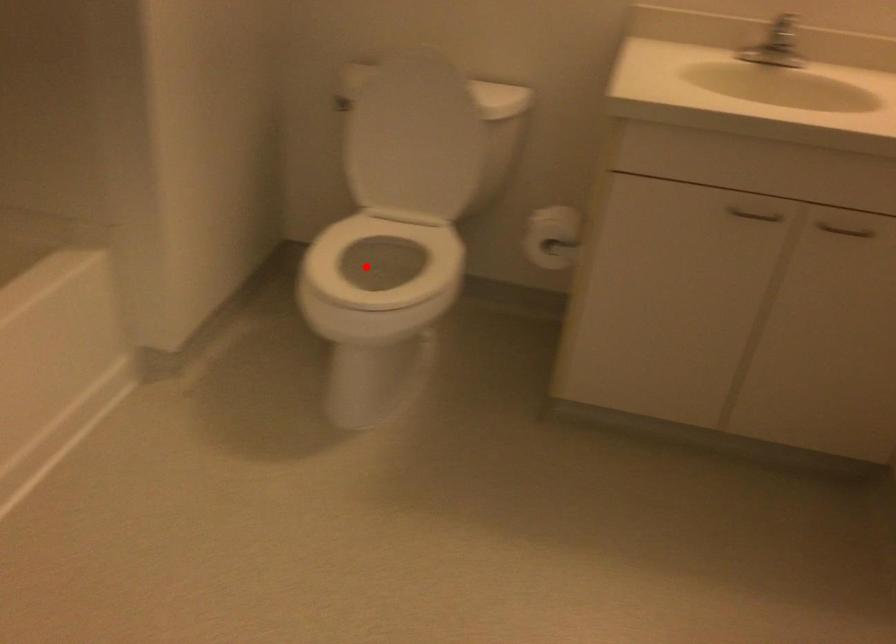
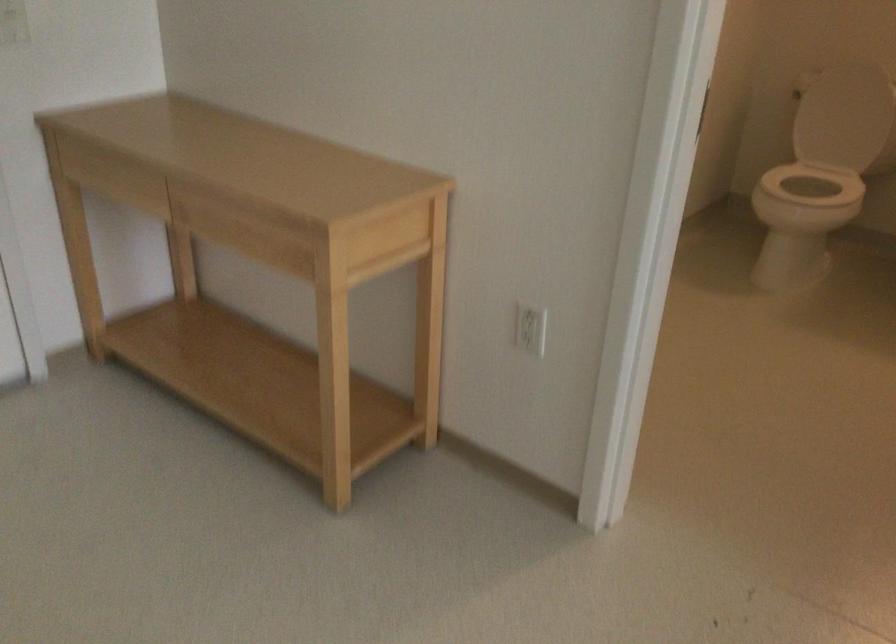
Question: I am providing you with two images of the same scene from different viewpoints. A red point is marked on the first image. Can you still see the location of the red point in image 2?

Choices:
 (A) Yes
 (B) No

Answer: (A)